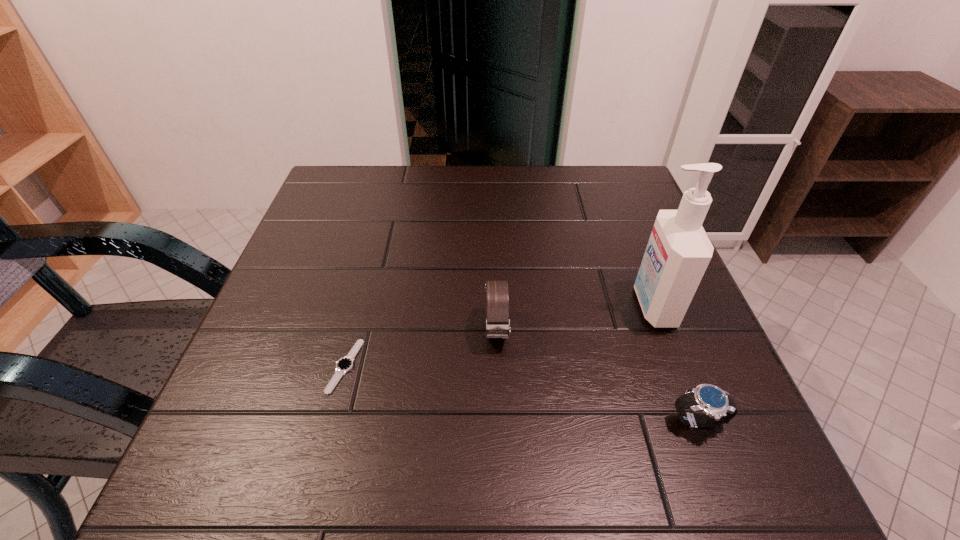
Find the location of a particular element. the tallest object is located at coordinates (678, 252).

You are a GUI agent. You are given a task and a screenshot of the screen. Output one action in this format:
    pyautogui.click(x=<x>, y=<y>)
    Task: Click on the second tallest object
    The width and height of the screenshot is (960, 540).
    Given the screenshot: What is the action you would take?
    pyautogui.click(x=497, y=297)

Find the location of a particular element. the tallest watch is located at coordinates (497, 297).

Where is `the second shortest object`? This screenshot has height=540, width=960. the second shortest object is located at coordinates (718, 406).

Find the location of a particular element. This screenshot has width=960, height=540. the second shortest watch is located at coordinates (718, 406).

I want to click on the leftmost object, so pos(345,364).

The height and width of the screenshot is (540, 960). Find the location of `the shortest object`. the shortest object is located at coordinates (345, 364).

Find the location of a particular element. The width and height of the screenshot is (960, 540). vacant space situated 0.360m on the front label of the cleansing agent is located at coordinates (451, 306).

At what (x,y) coordinates should I click in order to perform the action: click on vacant position located on the front label of the cleansing agent. Please return your answer as a coordinate pair (x, y). Looking at the image, I should click on (467, 306).

This screenshot has height=540, width=960. Identify the location of vacant area located 0.100m on the front label of the cleansing agent. (583, 306).